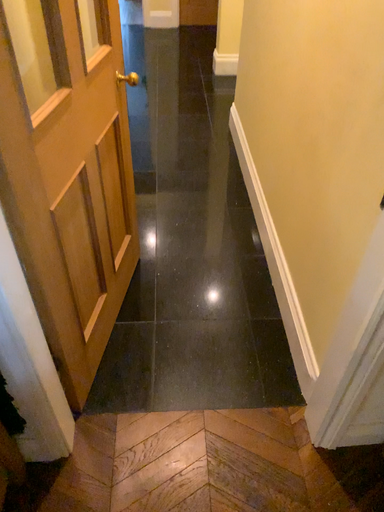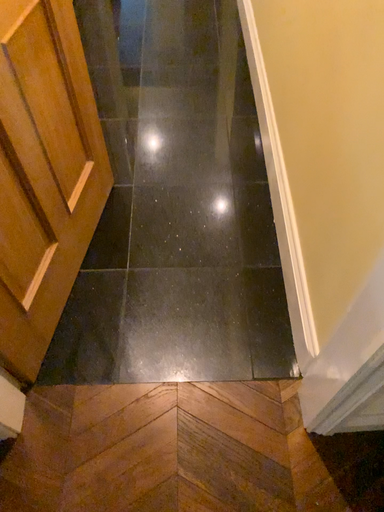
Question: How did the camera likely rotate when shooting the video?

Choices:
 (A) rotated upward
 (B) rotated downward

Answer: (B)